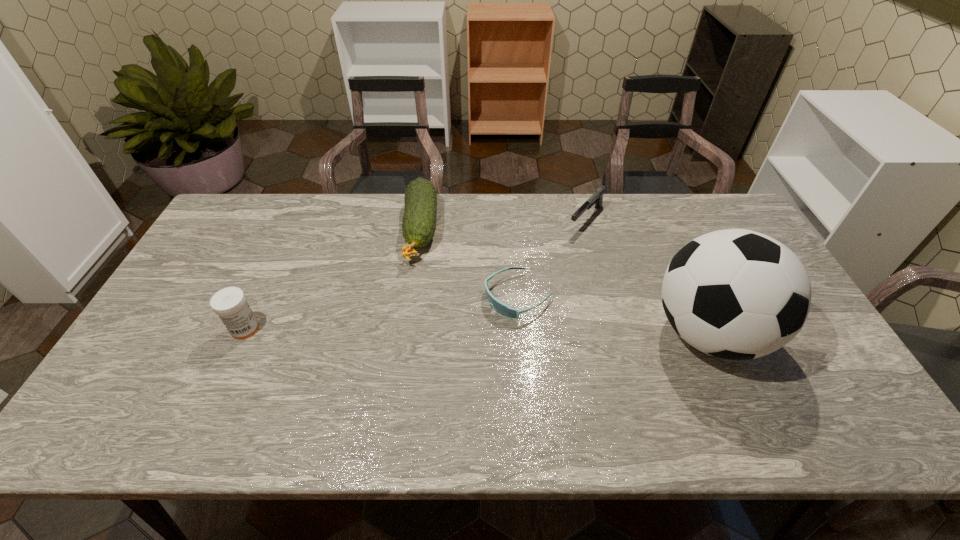
Identify which object is the fourth nearest to the second object from right to left. Please provide its 2D coordinates. Your answer should be formatted as a tuple, i.e. [(x, y)], where the tuple contains the x and y coordinates of a point satisfying the conditions above.

[(230, 304)]

Locate an element on the screen. free space that satisfies the following two spatial constraints: 1. on the back side of the gun; 2. on the left side of the second object from left to right is located at coordinates (421, 219).

Identify the location of vacant space that satisfies the following two spatial constraints: 1. on the front side of the fourth object from left to right; 2. on the right side of the rightmost object. This screenshot has width=960, height=540. (616, 333).